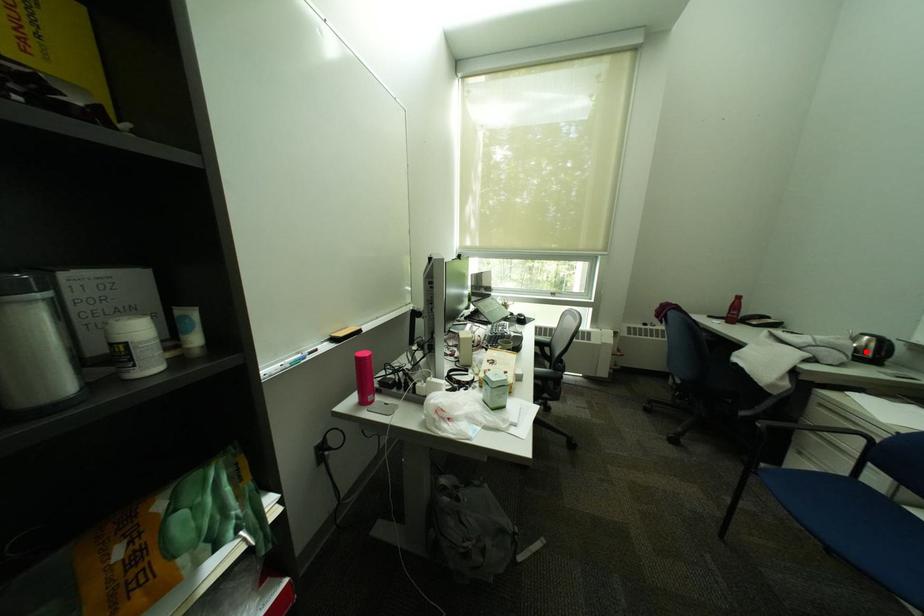
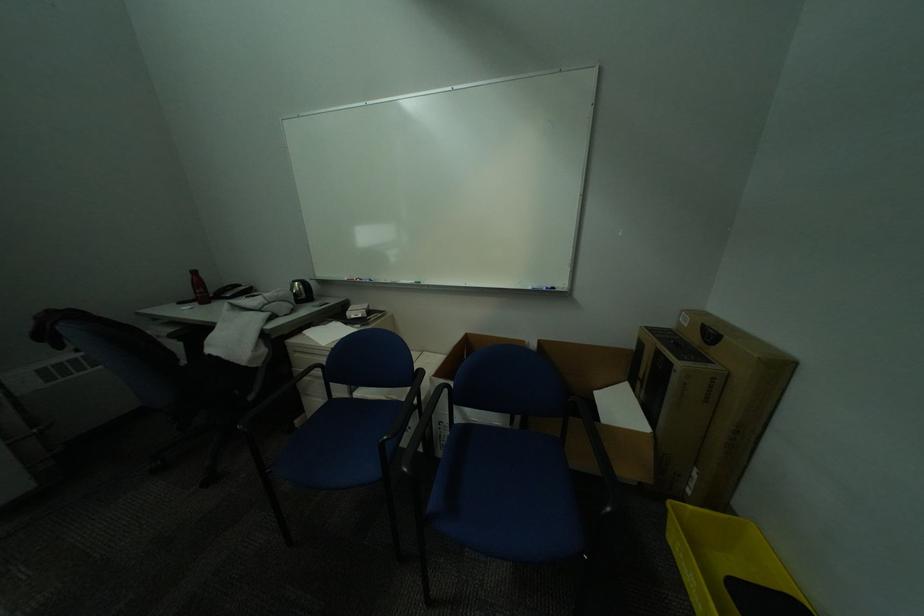
Locate, in the second image, the point that corresponds to the highlighted location in the first image.

(307, 296)